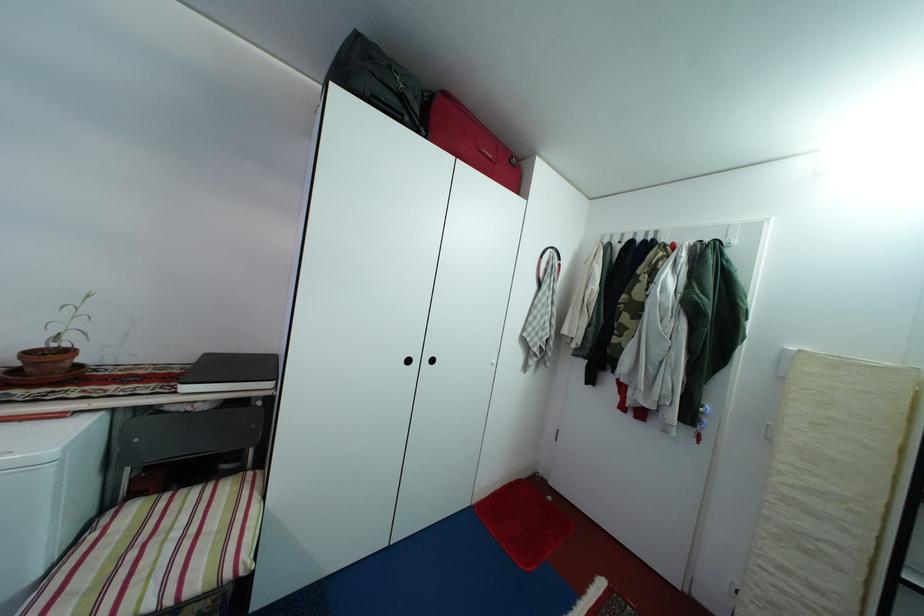
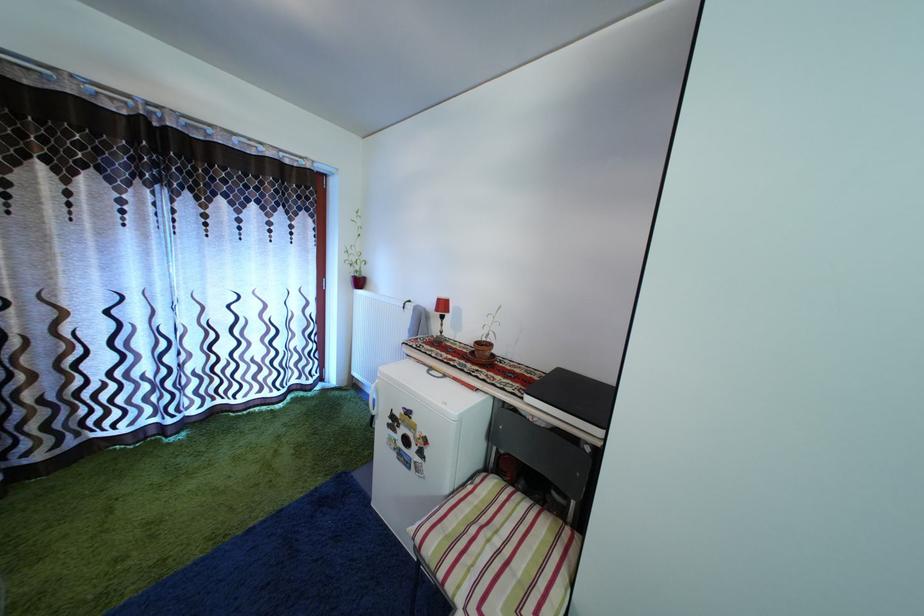
Question: I am providing you with two images of the same scene from different viewpoints. Which of the following objects are not visible in image2?

Choices:
 (A) terracotta plant pot
 (B) striped chair sitting surface
 (C) red table lamp
 (D) none of these

Answer: (D)